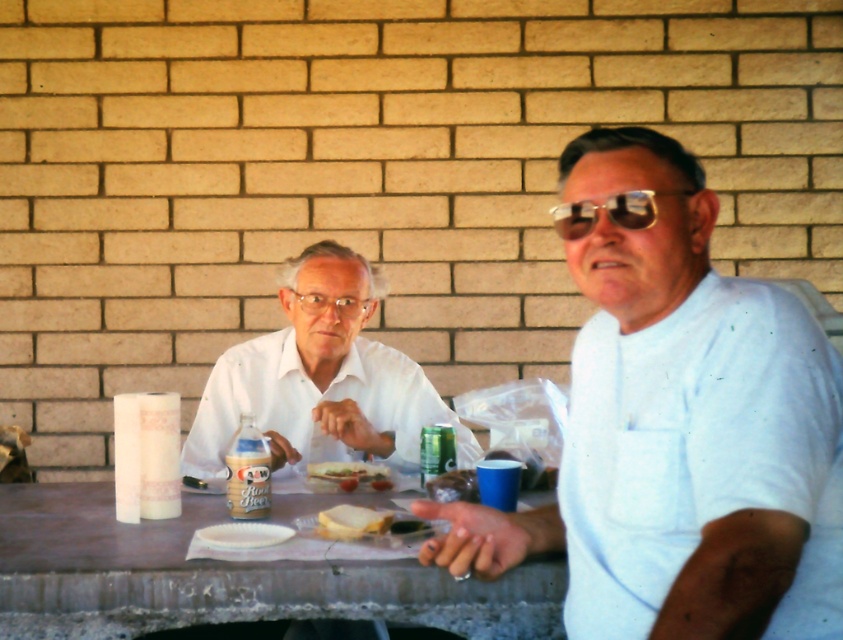
You are standing at the entrance of the patio and want to sit down at the wooden table at center. Which direction should you walk to reach it?

The wooden table at center is located at point coordinates, so you should walk towards the center of the patio to reach it.

You are a fashion designer observing the image. You need to determine which item is wider between the white matte shirt at right and the gold reflective sunglasses at center. Which one is wider?

The white matte shirt at right is wider than the gold reflective sunglasses at center, as stated in the description that the white matte shirt at right surpasses the sunglasses in width.

You are a waiter at an outdoor restaurant. You need to place a new order for a customer. The customer wants their drink to be as far away as possible from the wooden table at center. Where should you place the green metallic can at center?

The wooden table at center is bigger than the green metallic can at center, so to place the green metallic can at center as far away as possible from the wooden table at center, you should position it on the edge of the table opposite to where the customer is sitting, ensuring it is not obstructed by any other items.